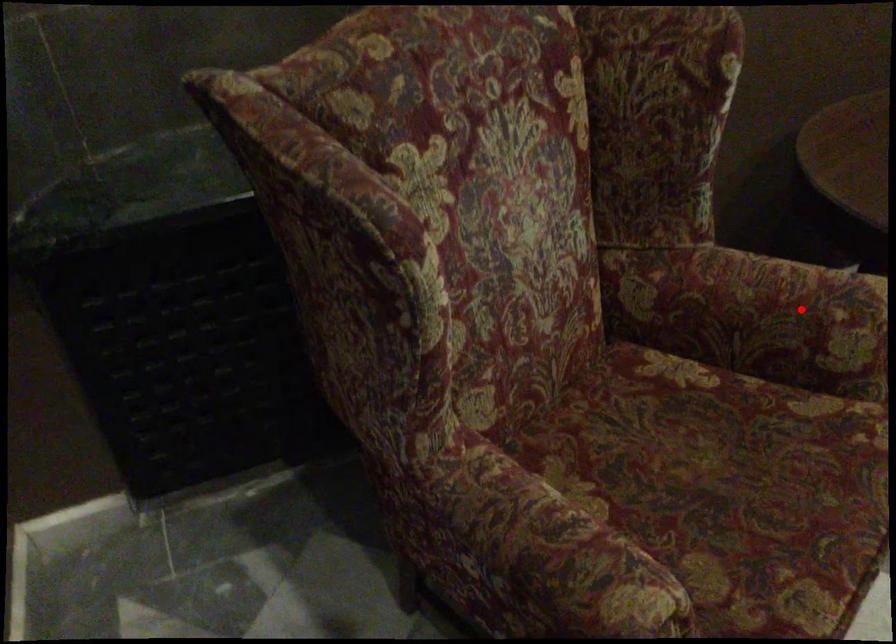
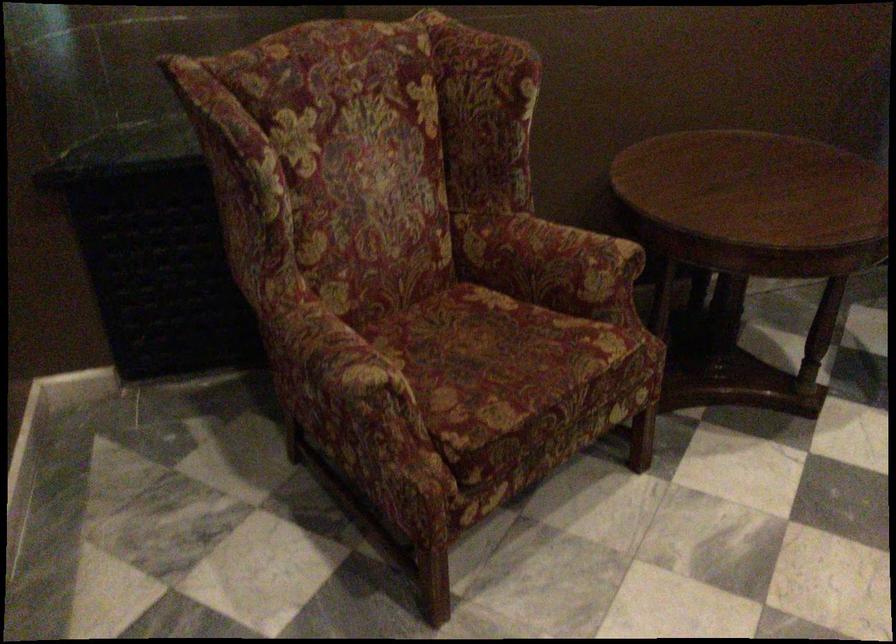
Locate, in the second image, the point that corresponds to the highlighted location in the first image.

(572, 256)